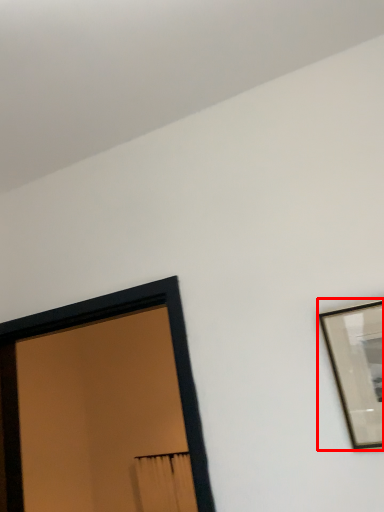
Question: From the image's perspective, what is the correct spatial relationship of picture frame (annotated by the red box) in relation to picture frame?

Choices:
 (A) above
 (B) below

Answer: (A)